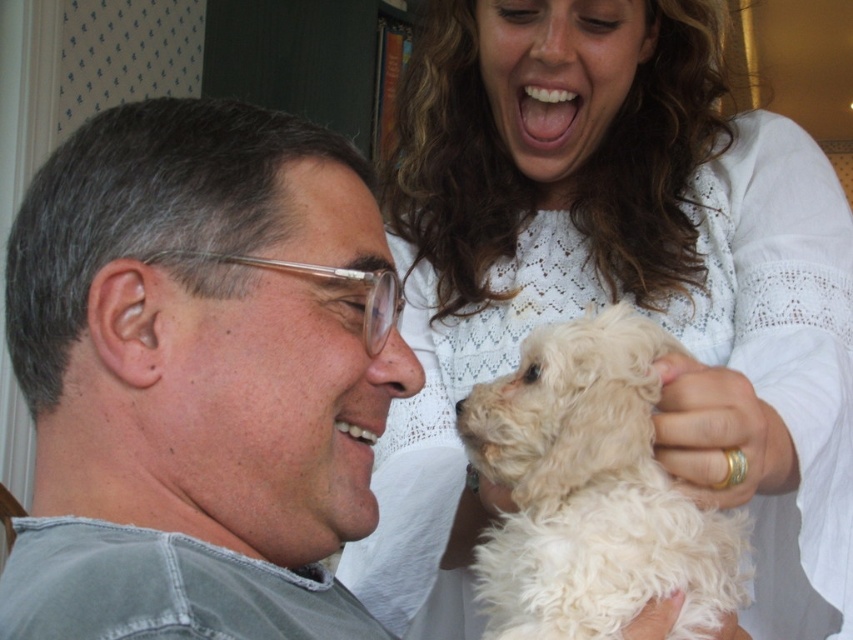
This screenshot has height=640, width=853. Describe the element at coordinates (614, 285) in the screenshot. I see `white lace sweater at upper center` at that location.

Looking at this image, is white lace sweater at upper center above white fluffy dog at upper right?

Correct, white lace sweater at upper center is located above white fluffy dog at upper right.

Is point (537, 240) more distant than point (651, 360)?

Yes, point (537, 240) is behind point (651, 360).

Where is `white lace sweater at upper center`? white lace sweater at upper center is located at coordinates (614, 285).

From the picture: Does gray denim shirt at left appear on the left side of white fluffy dog at upper right?

Correct, you'll find gray denim shirt at left to the left of white fluffy dog at upper right.

Can you confirm if gray denim shirt at left is bigger than white fluffy dog at upper right?

Yes.

Which is behind, point (85, 156) or point (648, 388)?

Positioned behind is point (648, 388).

Where is `gray denim shirt at left`? The height and width of the screenshot is (640, 853). gray denim shirt at left is located at coordinates (199, 356).

Is the position of white lace sweater at upper center less distant than that of gray denim shirt at left?

No, white lace sweater at upper center is further to the viewer.

Is point (483, 291) farther from camera compared to point (350, 243)?

Yes, it is.

Is point (694, 353) more distant than point (172, 614)?

That is True.

The image size is (853, 640). I want to click on white lace sweater at upper center, so click(x=614, y=285).